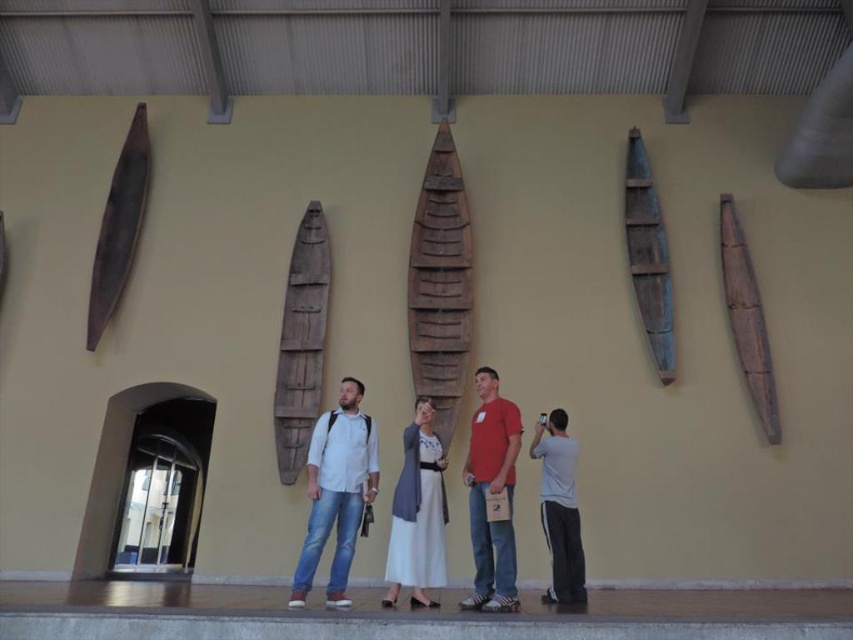
Does white matte shirt at center have a lesser width compared to brown wooden canoe at center?

No.

Between white matte shirt at center and brown wooden canoe at center, which one has more height?

Standing taller between the two is brown wooden canoe at center.

Does point (375, 486) lie in front of point (293, 432)?

Yes, it is in front of point (293, 432).

Locate an element on the screen. The width and height of the screenshot is (853, 640). white matte shirt at center is located at coordinates (335, 492).

Does matte red t-shirt at center appear over white cotton dress at center?

Yes, matte red t-shirt at center is above white cotton dress at center.

Is matte red t-shirt at center bigger than white cotton dress at center?

Indeed, matte red t-shirt at center has a larger size compared to white cotton dress at center.

You are a GUI agent. You are given a task and a screenshot of the screen. Output one action in this format:
    pyautogui.click(x=<x>, y=<y>)
    Task: Click on the matte red t-shirt at center
    
    Given the screenshot: What is the action you would take?
    pyautogui.click(x=491, y=492)

At what (x,y) coordinates should I click in order to perform the action: click on matte red t-shirt at center. Please return your answer as a coordinate pair (x, y). Looking at the image, I should click on (491, 492).

Which is in front, point (335, 605) or point (477, 388)?

Point (335, 605) is in front.

This screenshot has height=640, width=853. What do you see at coordinates (335, 492) in the screenshot?
I see `white matte shirt at center` at bounding box center [335, 492].

You are a GUI agent. You are given a task and a screenshot of the screen. Output one action in this format:
    pyautogui.click(x=<x>, y=<y>)
    Task: Click on the white matte shirt at center
    
    Given the screenshot: What is the action you would take?
    pyautogui.click(x=335, y=492)